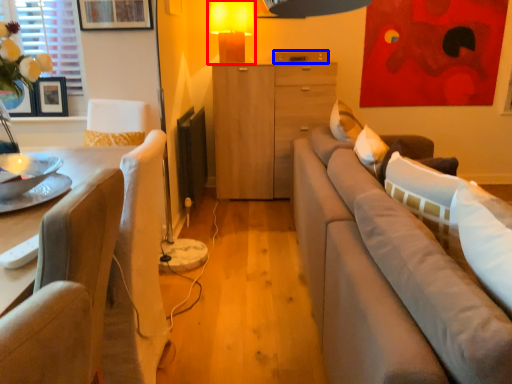
Question: Which of the following is the farthest to the observer, table lamp (highlighted by a red box) or drawer (highlighted by a blue box)?

Choices:
 (A) table lamp
 (B) drawer

Answer: (B)